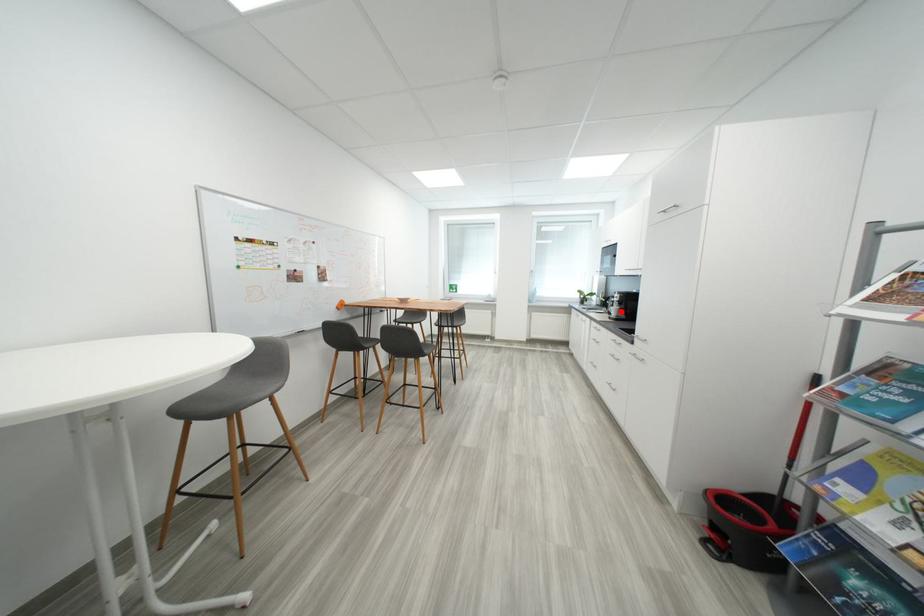
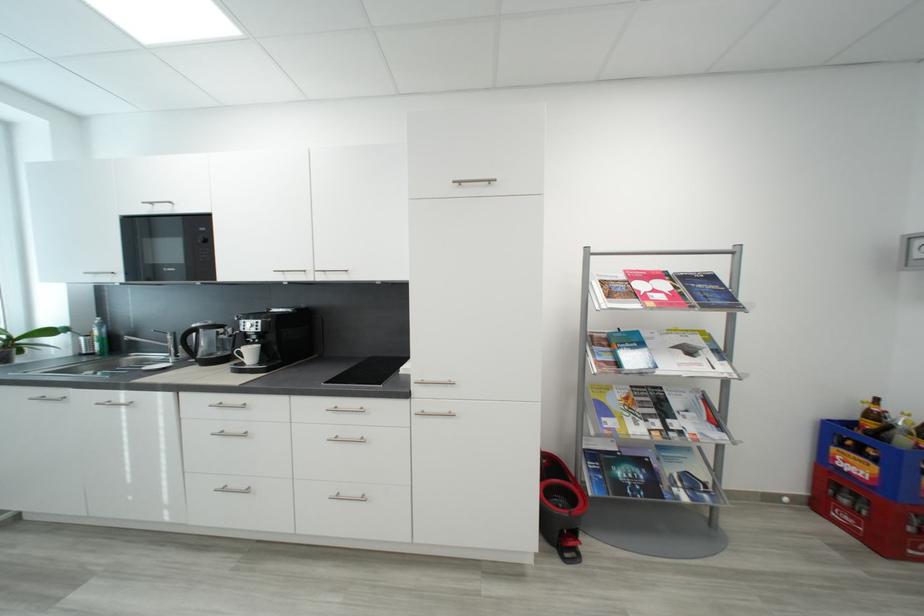
Question: I am providing you with two images of the same scene from different viewpoints. In image1, a red point is highlighted. Considering the same 3D point in image2, which of the following is correct?

Choices:
 (A) It is closer
 (B) It is farther

Answer: (B)